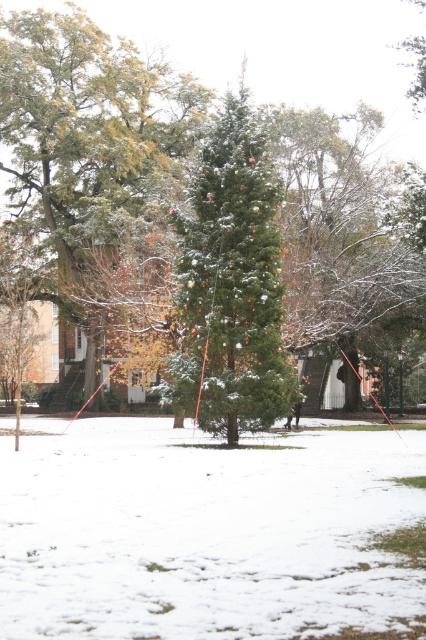
Question: Which object is positioned closest to the green matte tree at center?

Choices:
 (A) green matte evergreen tree at center
 (B) white fluffy snow at center

Answer: (B)

Question: Is white fluffy snow at center to the left of green matte tree at center from the viewer's perspective?

Choices:
 (A) no
 (B) yes

Answer: (A)

Question: Which object is positioned farthest from the white fluffy snow at center?

Choices:
 (A) green matte evergreen tree at center
 (B) green matte tree at center

Answer: (A)

Question: Can you confirm if white fluffy snow at center is smaller than green matte tree at center?

Choices:
 (A) yes
 (B) no

Answer: (B)

Question: Estimate the real-world distances between objects in this image. Which object is closer to the green matte tree at center?

Choices:
 (A) green matte evergreen tree at center
 (B) white fluffy snow at center

Answer: (B)

Question: Can you confirm if white fluffy snow at center is positioned below green matte evergreen tree at center?

Choices:
 (A) no
 (B) yes

Answer: (B)